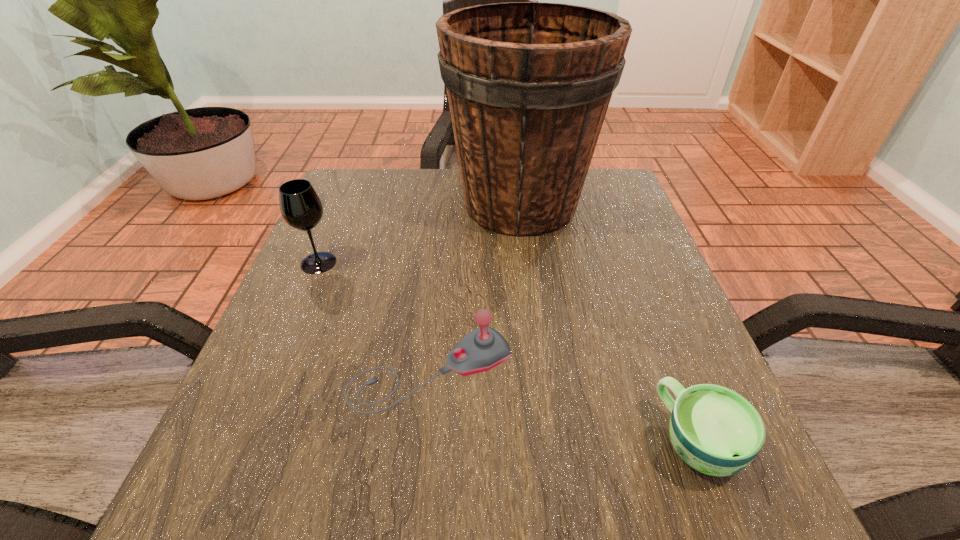
In the image, there is a desktop. At what (x,y) coordinates should I click in order to perform the action: click on vacant region at the right edge. Please return your answer as a coordinate pair (x, y). The height and width of the screenshot is (540, 960). Looking at the image, I should click on (611, 227).

Find the location of a particular element. Image resolution: width=960 pixels, height=540 pixels. free space at the far left corner is located at coordinates (348, 169).

Identify the location of free space at the far right corner of the desktop. Image resolution: width=960 pixels, height=540 pixels. (603, 182).

You are a GUI agent. You are given a task and a screenshot of the screen. Output one action in this format:
    pyautogui.click(x=<x>, y=<y>)
    Task: Click on the free location at the near right corner of the desktop
    
    Given the screenshot: What is the action you would take?
    pyautogui.click(x=658, y=468)

Where is `vacant space in between the leftmost object and the bucket`? The image size is (960, 540). vacant space in between the leftmost object and the bucket is located at coordinates (420, 234).

Locate an element on the screen. The height and width of the screenshot is (540, 960). empty location between the bucket and the cup is located at coordinates (609, 322).

This screenshot has width=960, height=540. I want to click on free point between the wineglass and the farthest object, so 420,234.

Identify the location of free spot between the farthest object and the third tallest object. (475, 287).

Image resolution: width=960 pixels, height=540 pixels. I want to click on empty location between the shortest object and the second shortest object, so click(x=564, y=406).

At what (x,y) coordinates should I click in order to perform the action: click on vacant region between the wineglass and the bucket. Please return your answer as a coordinate pair (x, y). Image resolution: width=960 pixels, height=540 pixels. Looking at the image, I should click on (420, 234).